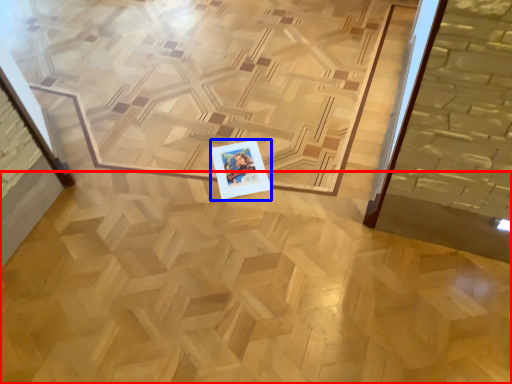
Question: Which point is closer to the camera, plywood (highlighted by a red box) or postcard (highlighted by a blue box)?

Choices:
 (A) plywood
 (B) postcard

Answer: (A)